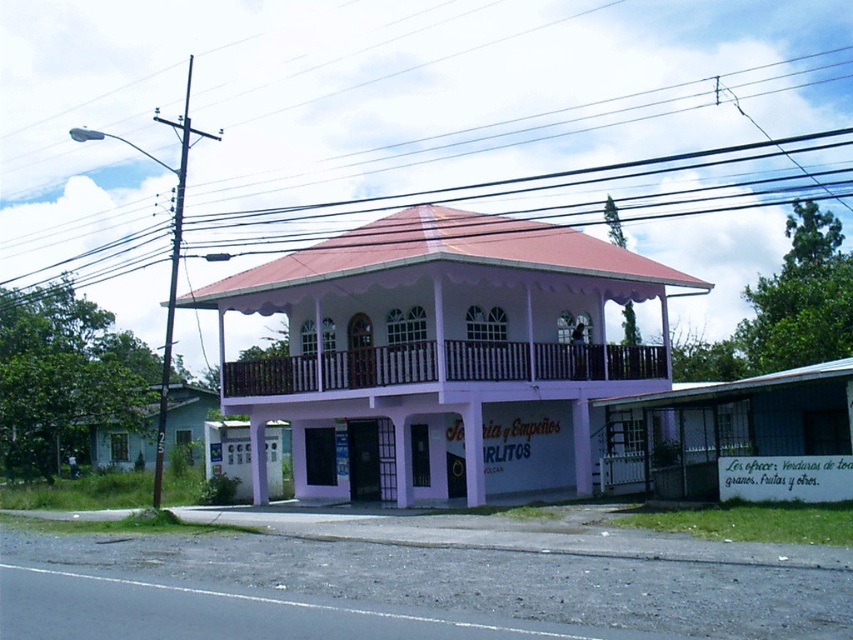
Question: Can you confirm if white matte gazebo at center is thinner than black wire at upper center?

Choices:
 (A) yes
 (B) no

Answer: (A)

Question: Which of the following is the farthest from the observer?

Choices:
 (A) (718, 180)
 (B) (584, 429)

Answer: (A)

Question: Does white matte gazebo at center have a greater width compared to black wire at upper center?

Choices:
 (A) yes
 (B) no

Answer: (B)

Question: Which of the following is the closest to the observer?

Choices:
 (A) (821, 186)
 (B) (309, 260)

Answer: (B)

Question: Is the position of white matte gazebo at center less distant than that of black wire at upper center?

Choices:
 (A) no
 (B) yes

Answer: (B)